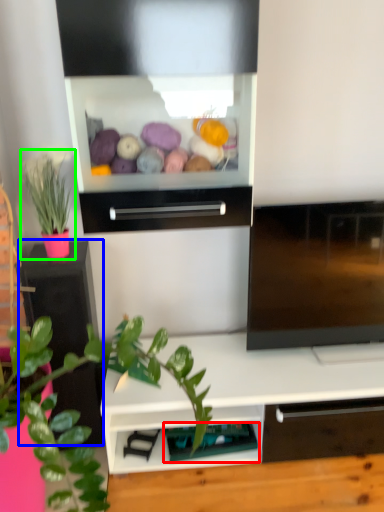
Question: Estimate the real-world distances between objects in this image. Which object is farther from shelf (highlighted by a red box), table (highlighted by a blue box) or houseplant (highlighted by a green box)?

Choices:
 (A) table
 (B) houseplant

Answer: (B)